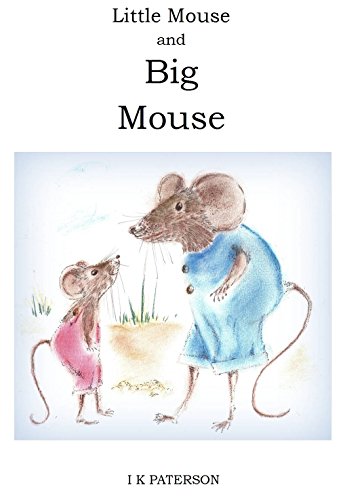
Identify the location of mouse. (84, 341), (223, 322).